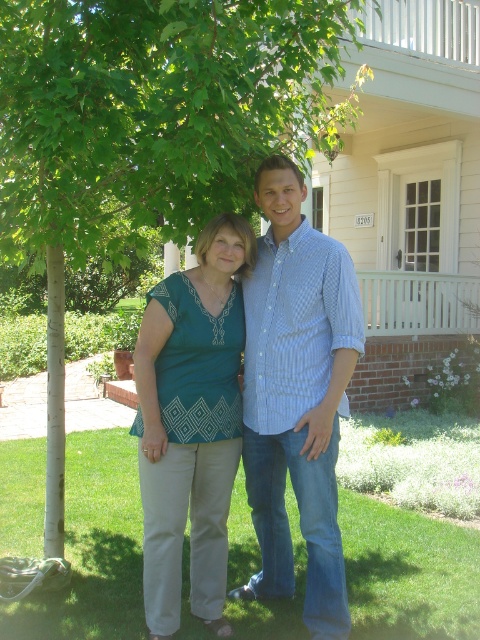
You are a photographer trying to capture a photo of the blue checkered shirt at center and the white painted wood porch at upper right. Which object is located to the left of the other?

The blue checkered shirt at center is positioned on the left side of white painted wood porch at upper right.

You are a tailor measuring for a new shirt. You see the blue checkered shirt at center and the white painted wood porch at upper right. Which object is narrower?

The blue checkered shirt at center is narrower than the white painted wood porch at upper right.